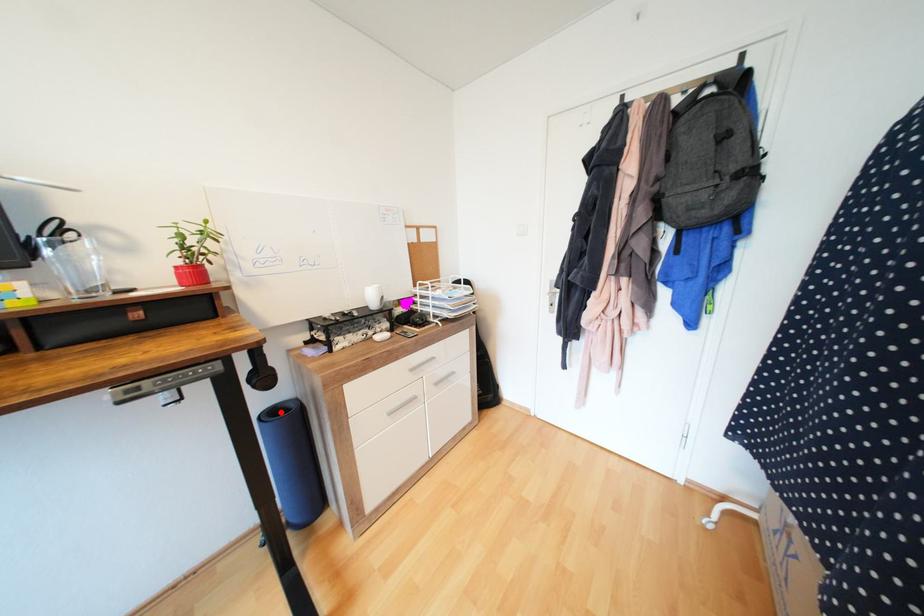
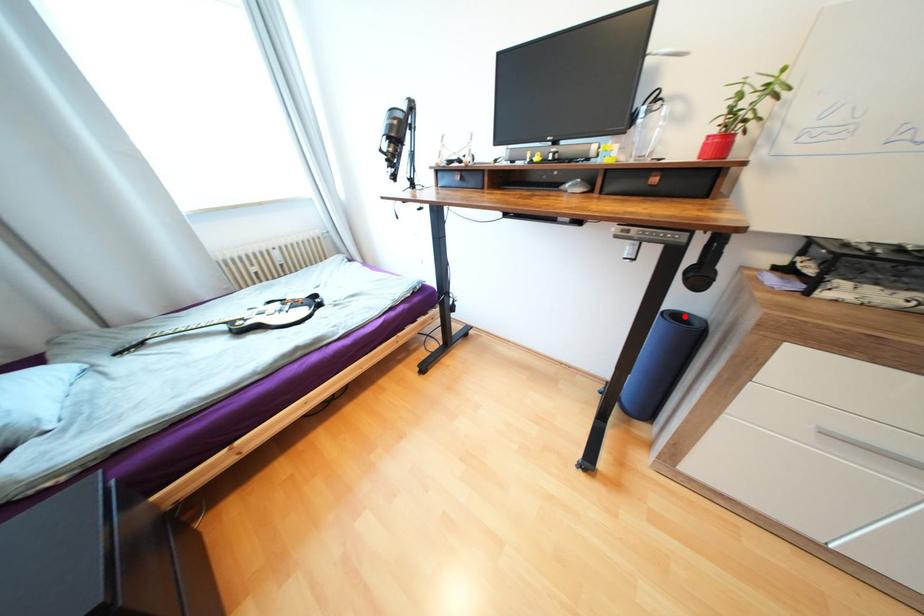
I am providing you with two images of the same scene from different viewpoints. A red point is marked on the first image and another point is marked on the second image. Is the red point in image1 aligned with the point shown in image2?

Yes